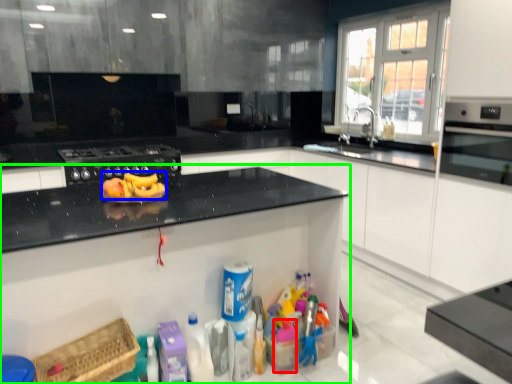
Question: Estimate the real-world distances between objects in this image. Which object is farther from cleaning product (highlighted by a red box), banana (highlighted by a blue box) or cabinetry (highlighted by a green box)?

Choices:
 (A) banana
 (B) cabinetry

Answer: (A)